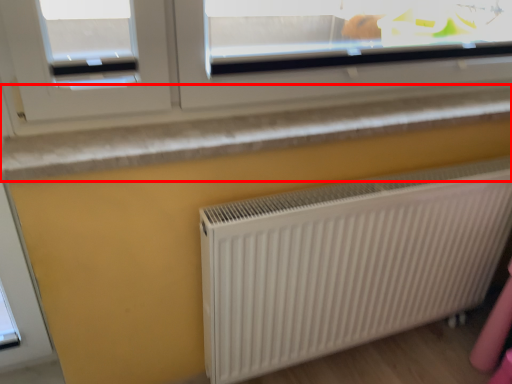
Question: From the image's perspective, what is the correct spatial relationship of window sill (annotated by the red box) in relation to radiator?

Choices:
 (A) below
 (B) above

Answer: (B)